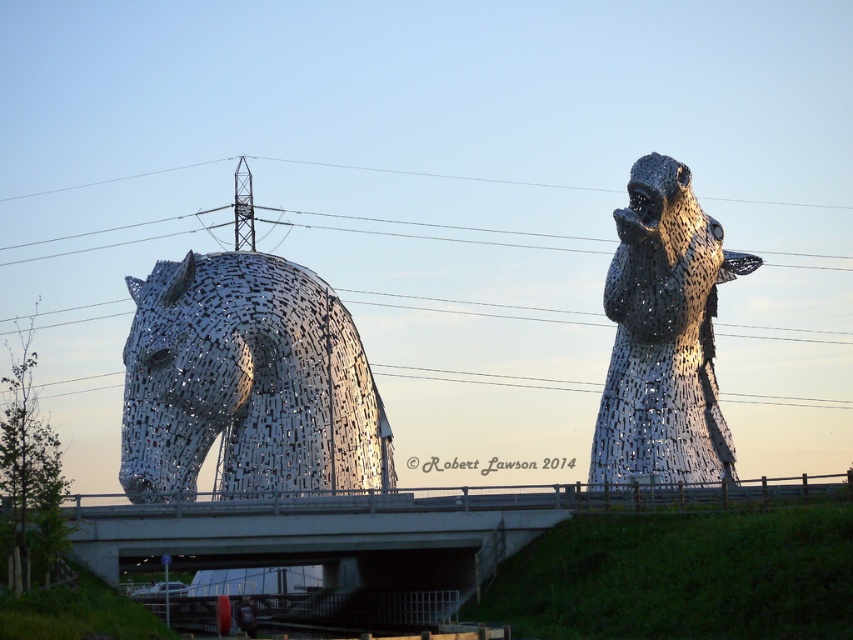
Who is more forward, (782, 484) or (657, 273)?

Point (657, 273) is more forward.

Does concrete bridge at center have a greater width compared to metallic mosaic horse at right?

Yes.

Is point (399, 513) positioned behind point (653, 346)?

No, it is not.

Find the location of `concrete bridge at center`. concrete bridge at center is located at coordinates (335, 536).

What do you see at coordinates (247, 381) in the screenshot?
I see `metallic horse at left` at bounding box center [247, 381].

Is metallic horse at left below metallic wire at upper center?

Correct, metallic horse at left is located below metallic wire at upper center.

The height and width of the screenshot is (640, 853). In order to click on metallic horse at left in this screenshot , I will do `click(247, 381)`.

Find the location of a particular element. metallic horse at left is located at coordinates (247, 381).

Does metallic horse at left have a lesser height compared to concrete bridge at center?

No, metallic horse at left is not shorter than concrete bridge at center.

Is point (196, 314) positioned behind point (538, 513)?

No, (196, 314) is closer to viewer.

Which is behind, point (276, 406) or point (352, 624)?

The point (352, 624) is behind.

Where is `metallic horse at left`? This screenshot has width=853, height=640. metallic horse at left is located at coordinates (247, 381).